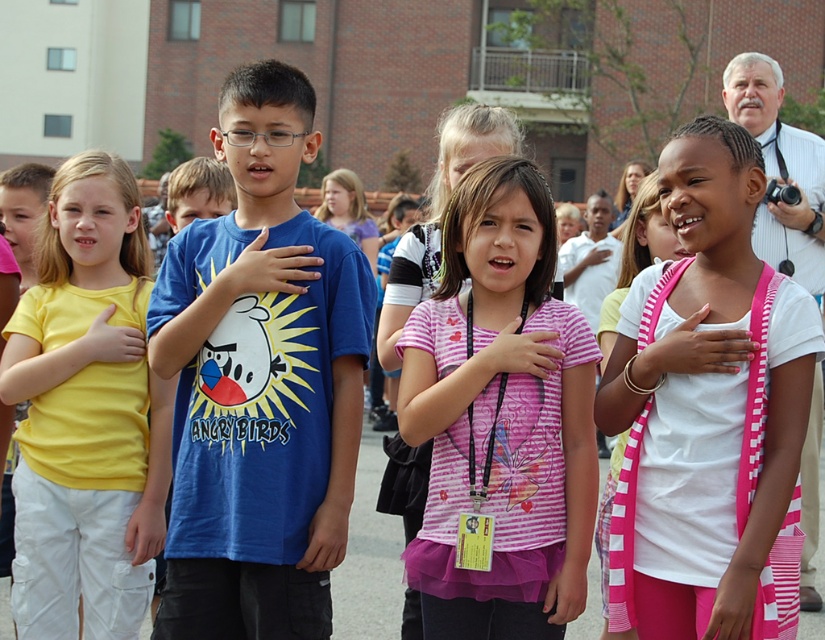
Question: Is blue matte t-shirt at center wider than pink striped cardigan at center?

Choices:
 (A) no
 (B) yes

Answer: (B)

Question: Which of the following is the farthest from the observer?

Choices:
 (A) blue matte t-shirt at center
 (B) pink striped cardigan at center

Answer: (A)

Question: Is the position of blue matte t-shirt at center more distant than that of yellow matte t-shirt at left?

Choices:
 (A) no
 (B) yes

Answer: (A)

Question: In this image, where is pink striped shirt at center located relative to yellow matte t-shirt at left?

Choices:
 (A) left
 (B) right

Answer: (B)

Question: Which point appears closest to the camera in this image?

Choices:
 (A) (330, 380)
 (B) (759, 404)
 (C) (540, 291)
 (D) (43, 483)

Answer: (B)

Question: Which point is closer to the camera taking this photo?

Choices:
 (A) (728, 531)
 (B) (90, 364)
 (C) (474, 310)

Answer: (A)